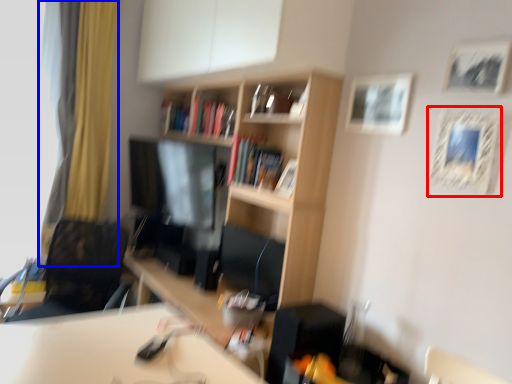
Question: Which of the following is the farthest to the observer, picture frame (highlighted by a red box) or curtain (highlighted by a blue box)?

Choices:
 (A) picture frame
 (B) curtain

Answer: (B)